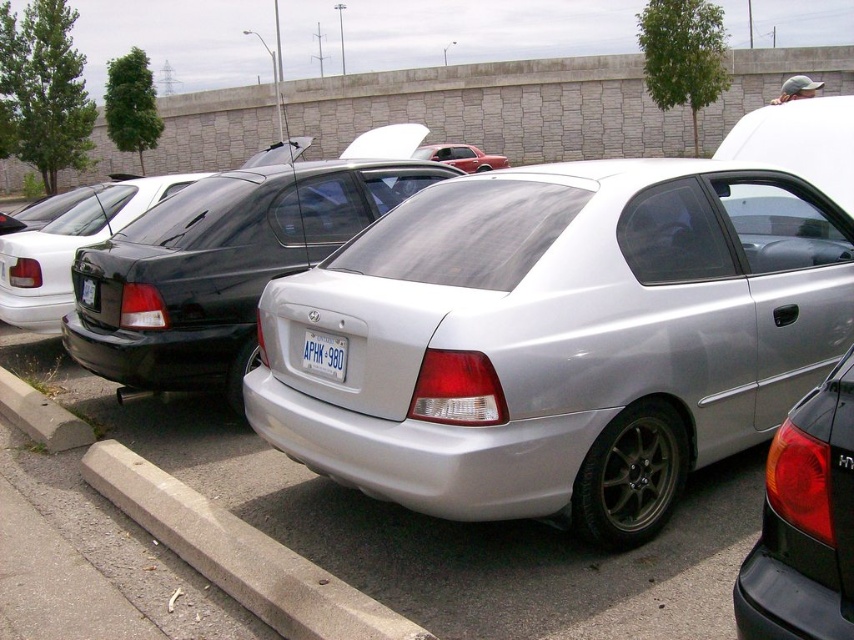
Question: Which of the following is the closest to the observer?

Choices:
 (A) (613, 396)
 (B) (208, 205)
 (C) (27, 392)
 (D) (837, 605)

Answer: (D)

Question: Is matte black tail light at center right thinner than concrete at lower left?

Choices:
 (A) yes
 (B) no

Answer: (A)

Question: Is satin silver car at center smaller than white plastic license plate at center?

Choices:
 (A) yes
 (B) no

Answer: (A)

Question: Is silver metallic car at center further to camera compared to white plastic license plate at center?

Choices:
 (A) yes
 (B) no

Answer: (B)

Question: Among these objects, which one is nearest to the camera?

Choices:
 (A) satin silver car at center
 (B) white plastic license plate at center

Answer: (B)

Question: Which of the following is the farthest from the observer?

Choices:
 (A) (654, 397)
 (B) (466, 172)
 (C) (767, 460)

Answer: (B)